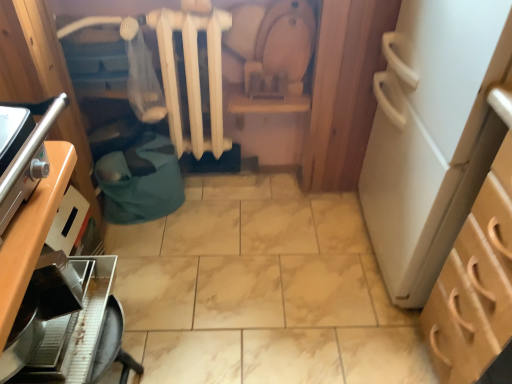
Question: Is wooden cabinet at left, marked as the first cabinetry in a left-to-right arrangement, to the left of light brown wood cabinet at right, which is counted as the first cabinetry, starting from the right, from the viewer's perspective?

Choices:
 (A) yes
 (B) no

Answer: (A)

Question: Is wooden cabinet at left, the second cabinetry viewed from the right, located outside light brown wood cabinet at right, the second cabinetry viewed from the left?

Choices:
 (A) yes
 (B) no

Answer: (A)

Question: Considering the relative positions of wooden cabinet at left, marked as the first cabinetry in a left-to-right arrangement, and light brown wood cabinet at right, the second cabinetry viewed from the left, in the image provided, is wooden cabinet at left, marked as the first cabinetry in a left-to-right arrangement, to the right of light brown wood cabinet at right, the second cabinetry viewed from the left, from the viewer's perspective?

Choices:
 (A) yes
 (B) no

Answer: (B)

Question: Is wooden cabinet at left, the second cabinetry viewed from the right, thinner than light brown wood cabinet at right, the second cabinetry viewed from the left?

Choices:
 (A) yes
 (B) no

Answer: (A)

Question: Does wooden cabinet at left, the second cabinetry viewed from the right, touch light brown wood cabinet at right, the second cabinetry viewed from the left?

Choices:
 (A) yes
 (B) no

Answer: (B)

Question: Would you consider wooden cabinet at left, the second cabinetry viewed from the right, to be distant from light brown wood cabinet at right, which is counted as the first cabinetry, starting from the right?

Choices:
 (A) yes
 (B) no

Answer: (A)

Question: Would you consider metallic silver coffee maker at lower left to be distant from light brown wood cabinet at right, which is counted as the first cabinetry, starting from the right?

Choices:
 (A) yes
 (B) no

Answer: (B)

Question: Considering the relative positions of metallic silver coffee maker at lower left and light brown wood cabinet at right, which is counted as the first cabinetry, starting from the right, in the image provided, is metallic silver coffee maker at lower left to the left of light brown wood cabinet at right, which is counted as the first cabinetry, starting from the right, from the viewer's perspective?

Choices:
 (A) yes
 (B) no

Answer: (A)

Question: Can you confirm if metallic silver coffee maker at lower left is thinner than light brown wood cabinet at right, the second cabinetry viewed from the left?

Choices:
 (A) yes
 (B) no

Answer: (A)

Question: Considering the relative sizes of metallic silver coffee maker at lower left and light brown wood cabinet at right, which is counted as the first cabinetry, starting from the right, in the image provided, is metallic silver coffee maker at lower left bigger than light brown wood cabinet at right, which is counted as the first cabinetry, starting from the right,?

Choices:
 (A) yes
 (B) no

Answer: (B)

Question: Is light brown wood cabinet at right, the second cabinetry viewed from the left, surrounded by metallic silver coffee maker at lower left?

Choices:
 (A) no
 (B) yes

Answer: (A)

Question: Considering the relative sizes of metallic silver coffee maker at lower left and light brown wood cabinet at right, which is counted as the first cabinetry, starting from the right, in the image provided, is metallic silver coffee maker at lower left wider than light brown wood cabinet at right, which is counted as the first cabinetry, starting from the right,?

Choices:
 (A) yes
 (B) no

Answer: (B)

Question: Is metallic silver coffee maker at lower left placed right next to white matte radiator at center?

Choices:
 (A) no
 (B) yes

Answer: (A)